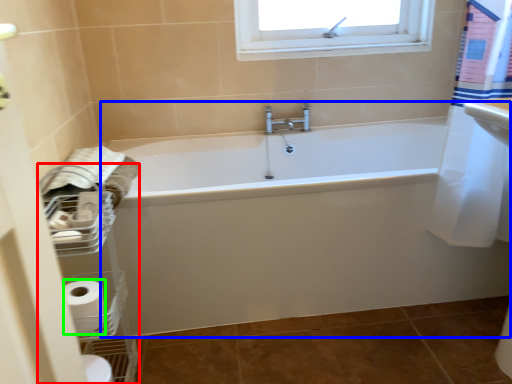
Question: Based on their relative distances, which object is farther from balustrade (highlighted by a red box)? Choose from bathtub (highlighted by a blue box) and toilet paper (highlighted by a green box).

Choices:
 (A) bathtub
 (B) toilet paper

Answer: (A)